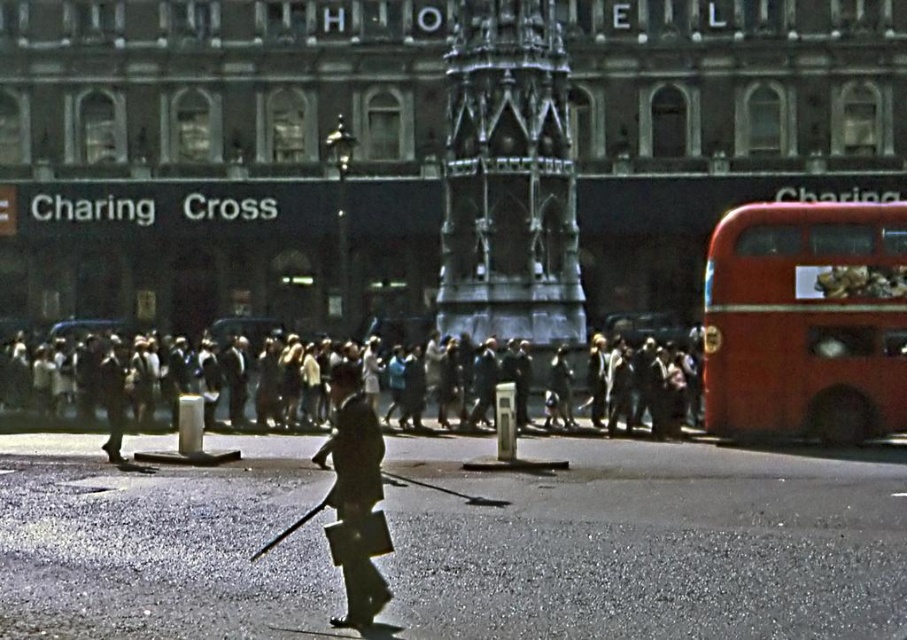
Question: Can you confirm if red rubber bus at right is wider than dark gray uniform at center?

Choices:
 (A) yes
 (B) no

Answer: (A)

Question: Among these points, which one is nearest to the camera?

Choices:
 (A) (691, 410)
 (B) (342, 476)
 (C) (816, 342)

Answer: (B)

Question: Which point is closer to the camera?

Choices:
 (A) dark gray uniform at center
 (B) dark gray concrete crowd at center
 (C) red rubber bus at right

Answer: (A)

Question: Does red rubber bus at right have a smaller size compared to dark gray uniform at center?

Choices:
 (A) yes
 (B) no

Answer: (B)

Question: Which point appears farthest from the camera in this image?

Choices:
 (A) (358, 550)
 (B) (54, 420)

Answer: (B)

Question: Does red rubber bus at right have a greater width compared to dark gray uniform at center?

Choices:
 (A) no
 (B) yes

Answer: (B)